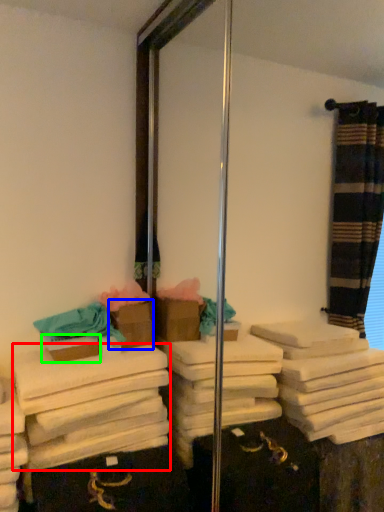
Question: Which object is positioned closest to bath towel (highlighted by a red box)? Select from box (highlighted by a blue box) and box (highlighted by a green box).

Choices:
 (A) box
 (B) box

Answer: (B)